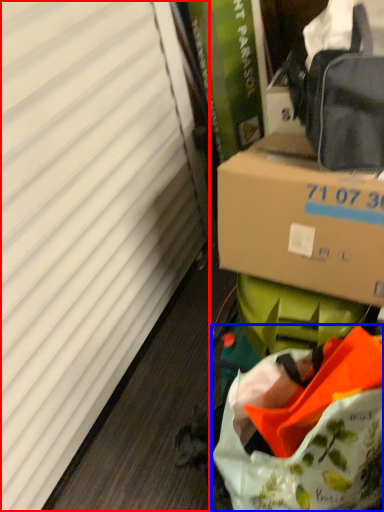
Question: Which object appears closest to the camera in this image, curtain (highlighted by a red box) or bag (highlighted by a blue box)?

Choices:
 (A) curtain
 (B) bag

Answer: (A)